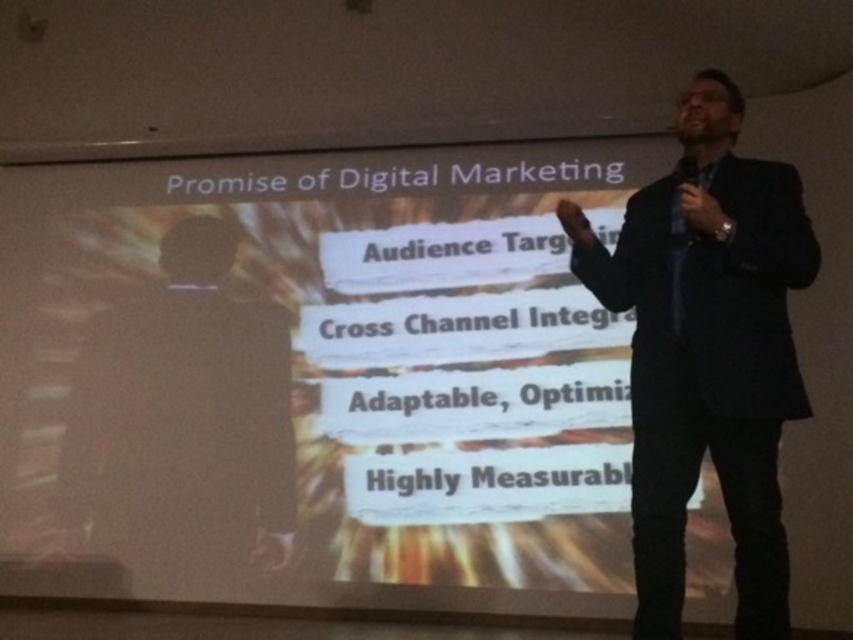
Is point (144, 557) positioned behind point (712, 419)?

Yes, point (144, 557) is farther from viewer.

Does white matte projector screen at upper center have a smaller size compared to dark blue suit at center?

No, white matte projector screen at upper center is not smaller than dark blue suit at center.

Find the location of a particular element. The height and width of the screenshot is (640, 853). white matte projector screen at upper center is located at coordinates (318, 380).

Which of these two, dark blue suit at center or black suit at center, stands shorter?

dark blue suit at center

Is the position of dark blue suit at center more distant than that of black suit at center?

No, it is not.

Is point (674, 237) positioned in front of point (228, 340)?

That is True.

The width and height of the screenshot is (853, 640). In order to click on dark blue suit at center in this screenshot , I will do `click(706, 352)`.

Which is in front, point (160, 413) or point (177, 310)?

Positioned in front is point (160, 413).

Is white matte projector screen at upper center thinner than black suit at center?

Incorrect, white matte projector screen at upper center's width is not less than black suit at center's.

At what (x,y) coordinates should I click in order to perform the action: click on white matte projector screen at upper center. Please return your answer as a coordinate pair (x, y). This screenshot has height=640, width=853. Looking at the image, I should click on (318, 380).